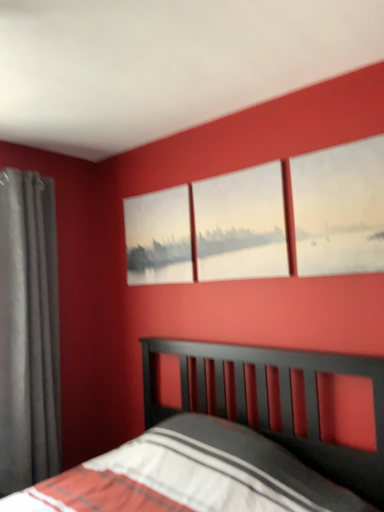
Question: Considering the relative sizes of white matte painting at center, which appears as the 2th window when viewed from the front, and matte canvas painting at upper right, acting as the first window starting from the right, in the image provided, is white matte painting at center, which appears as the 2th window when viewed from the front, taller than matte canvas painting at upper right, acting as the first window starting from the right,?

Choices:
 (A) yes
 (B) no

Answer: (B)

Question: From a real-world perspective, is white matte painting at center, acting as the first window starting from the back, on matte canvas painting at upper right, positioned as the 1th window in front-to-back order?

Choices:
 (A) yes
 (B) no

Answer: (A)

Question: Is white matte painting at center, placed as the first window when sorted from left to right, looking in the opposite direction of matte canvas painting at upper right, arranged as the second window when viewed from the back?

Choices:
 (A) no
 (B) yes

Answer: (A)

Question: Is white matte painting at center, placed as the first window when sorted from left to right, smaller than matte canvas painting at upper right, acting as the first window starting from the right?

Choices:
 (A) no
 (B) yes

Answer: (A)

Question: Can you confirm if white matte painting at center, the second window when ordered from right to left, is bigger than matte canvas painting at upper right, arranged as the second window when viewed from the back?

Choices:
 (A) yes
 (B) no

Answer: (A)

Question: Is matte canvas painting at upper right, positioned as the 1th window in front-to-back order, spatially inside matte canvas painting at center, or outside of it?

Choices:
 (A) inside
 (B) outside

Answer: (B)

Question: Based on their sizes in the image, would you say matte canvas painting at upper right, arranged as the second window when viewed from the back, is bigger or smaller than matte canvas painting at center?

Choices:
 (A) small
 (B) big

Answer: (A)

Question: Is matte canvas painting at upper right, positioned as the 2th window in left-to-right order, wider or thinner than matte canvas painting at center?

Choices:
 (A) wide
 (B) thin

Answer: (B)

Question: Considering the positions of matte canvas painting at upper right, acting as the first window starting from the right, and matte canvas painting at center in the image, is matte canvas painting at upper right, acting as the first window starting from the right, taller or shorter than matte canvas painting at center?

Choices:
 (A) short
 (B) tall

Answer: (B)

Question: From the image's perspective, relative to matte gray curtain at left, is matte canvas painting at center above or below?

Choices:
 (A) below
 (B) above

Answer: (B)

Question: Looking at the image, does matte canvas painting at center seem bigger or smaller compared to matte gray curtain at left?

Choices:
 (A) big
 (B) small

Answer: (B)

Question: From their relative heights in the image, would you say matte canvas painting at center is taller or shorter than matte gray curtain at left?

Choices:
 (A) tall
 (B) short

Answer: (B)

Question: Is matte canvas painting at center to the left or to the right of matte gray curtain at left in the image?

Choices:
 (A) left
 (B) right

Answer: (B)

Question: Do you think matte canvas painting at center is within matte canvas painting at upper right, acting as the first window starting from the right, or outside of it?

Choices:
 (A) inside
 (B) outside

Answer: (B)

Question: In the image, is matte canvas painting at center on the left side or the right side of matte canvas painting at upper right, positioned as the 1th window in front-to-back order?

Choices:
 (A) left
 (B) right

Answer: (A)